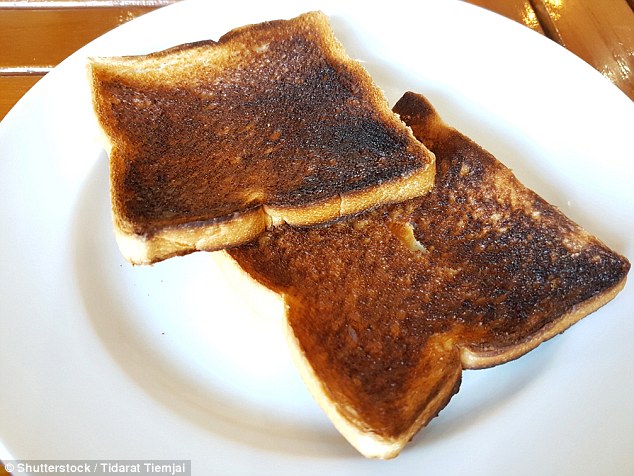
The width and height of the screenshot is (634, 476). Identify the location of grout. (44, 66), (82, 3).